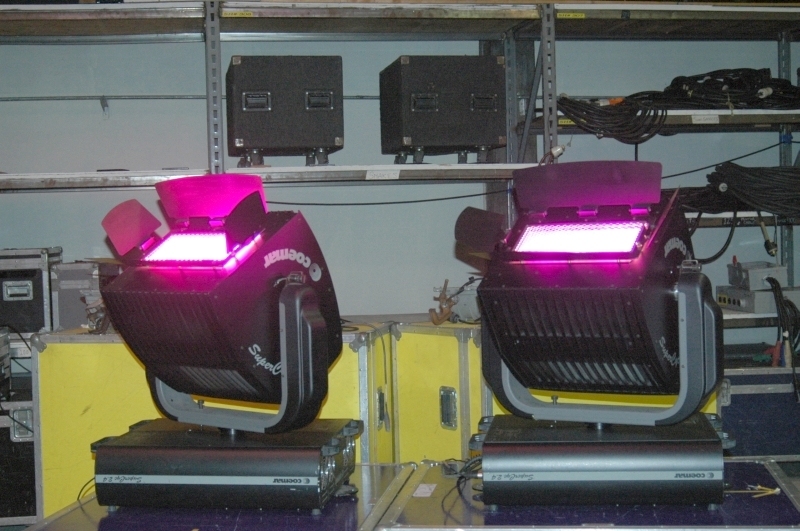
Locate an element on the screen. This screenshot has height=531, width=800. container handle is located at coordinates (446, 402), (381, 407).